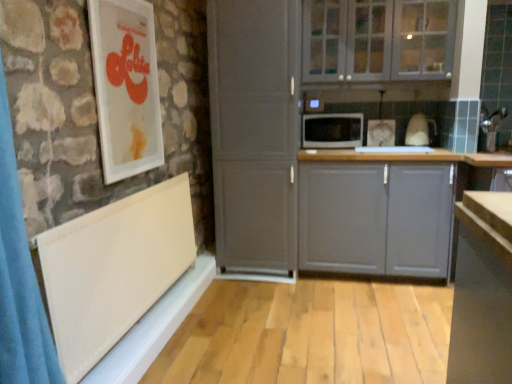
Question: Would you say white glossy picture frame at upper left is part of white textured window sill at lower left's contents?

Choices:
 (A) no
 (B) yes

Answer: (A)

Question: From the image's perspective, would you say white textured window sill at lower left is positioned over white glossy picture frame at upper left?

Choices:
 (A) no
 (B) yes

Answer: (A)

Question: Is white textured window sill at lower left behind white glossy picture frame at upper left?

Choices:
 (A) no
 (B) yes

Answer: (A)

Question: Is white textured window sill at lower left facing towards white glossy picture frame at upper left?

Choices:
 (A) no
 (B) yes

Answer: (A)

Question: Is white textured window sill at lower left to the left of white glossy picture frame at upper left from the viewer's perspective?

Choices:
 (A) yes
 (B) no

Answer: (B)

Question: Considering the positions of white textured radiator at lower left and white glossy picture frame at upper left in the image, is white textured radiator at lower left wider or thinner than white glossy picture frame at upper left?

Choices:
 (A) wide
 (B) thin

Answer: (A)

Question: Considering the positions of point (112, 367) and point (151, 69), is point (112, 367) closer or farther from the camera than point (151, 69)?

Choices:
 (A) closer
 (B) farther

Answer: (A)

Question: Considering the positions of white textured radiator at lower left and white glossy picture frame at upper left in the image, is white textured radiator at lower left taller or shorter than white glossy picture frame at upper left?

Choices:
 (A) tall
 (B) short

Answer: (B)

Question: In terms of size, does white textured radiator at lower left appear bigger or smaller than white glossy picture frame at upper left?

Choices:
 (A) big
 (B) small

Answer: (A)

Question: From a real-world perspective, relative to gray matte cabinet at center, which appears as the second cabinetry when viewed from the top, is white matte cabinet at center vertically above or below?

Choices:
 (A) above
 (B) below

Answer: (A)

Question: Is white matte cabinet at center to the left or to the right of gray matte cabinet at center, arranged as the 1th cabinetry when ordered from the bottom, in the image?

Choices:
 (A) right
 (B) left

Answer: (B)

Question: Considering the positions of white matte cabinet at center and gray matte cabinet at center, arranged as the 1th cabinetry when ordered from the bottom, in the image, is white matte cabinet at center taller or shorter than gray matte cabinet at center, arranged as the 1th cabinetry when ordered from the bottom,?

Choices:
 (A) short
 (B) tall

Answer: (B)

Question: Considering the positions of white matte cabinet at center and gray matte cabinet at center, which appears as the second cabinetry when viewed from the top, in the image, is white matte cabinet at center wider or thinner than gray matte cabinet at center, which appears as the second cabinetry when viewed from the top,?

Choices:
 (A) wide
 (B) thin

Answer: (A)

Question: Does point (310, 129) appear closer or farther from the camera than point (246, 241)?

Choices:
 (A) closer
 (B) farther

Answer: (B)

Question: Is black matte microwave at center in front of or behind white matte cabinet at center in the image?

Choices:
 (A) behind
 (B) front

Answer: (A)